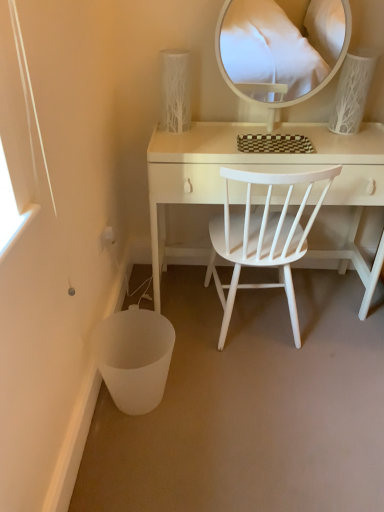
Where is `free space in front of white textured vase at upper right, the second table lamp positioned from the left`? The image size is (384, 512). free space in front of white textured vase at upper right, the second table lamp positioned from the left is located at coordinates (356, 144).